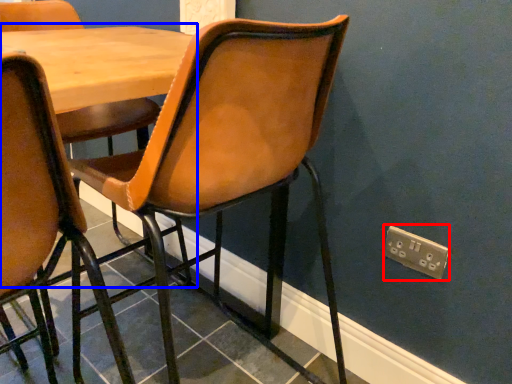
Question: Which object is closer to the camera taking this photo, electric outlet (highlighted by a red box) or table (highlighted by a blue box)?

Choices:
 (A) electric outlet
 (B) table

Answer: (B)